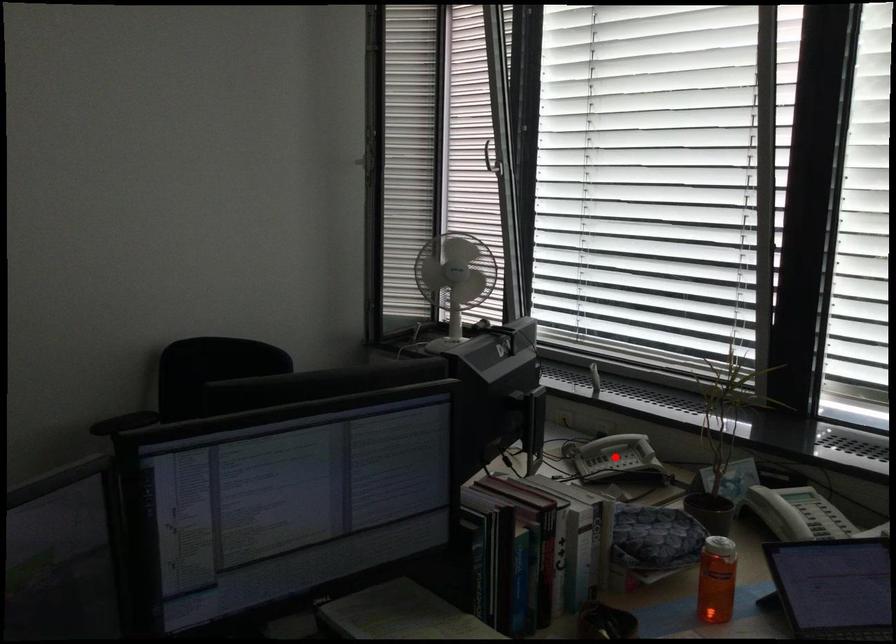
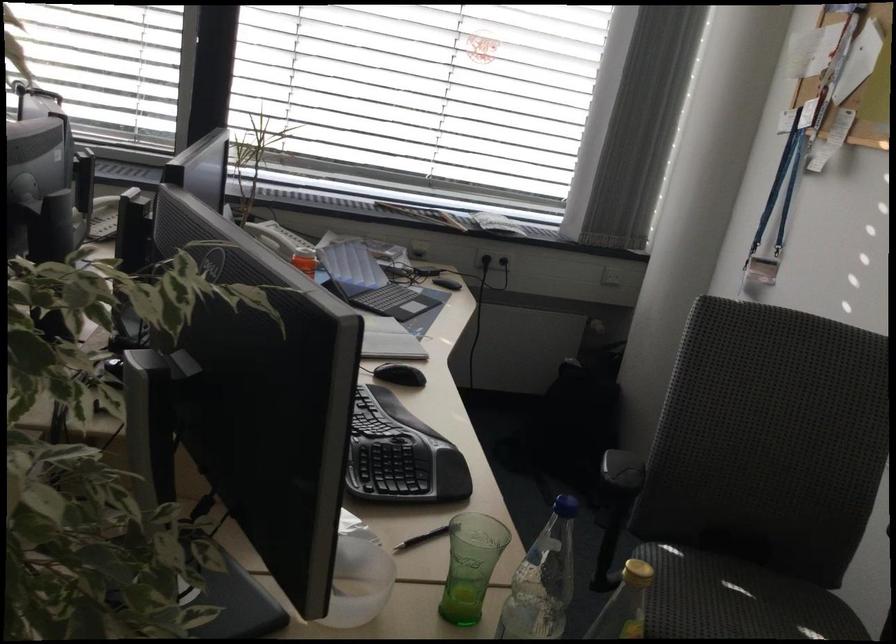
Question: I am providing you with two images of the same scene from different viewpoints. A red point is marked on the first image. At the location where the point appears in image 1, is it still visible in image 2?

Choices:
 (A) Yes
 (B) No

Answer: (B)